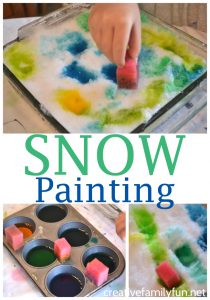
Where is `blue paint`? This screenshot has width=210, height=300. blue paint is located at coordinates (61, 293).